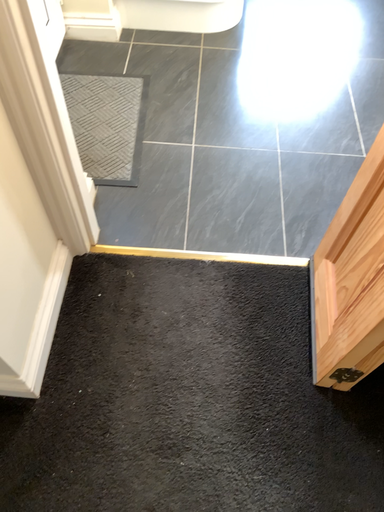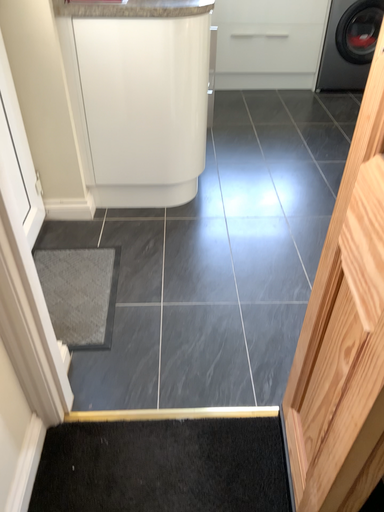
Question: How did the camera likely rotate when shooting the video?

Choices:
 (A) rotated downward
 (B) rotated upward

Answer: (B)